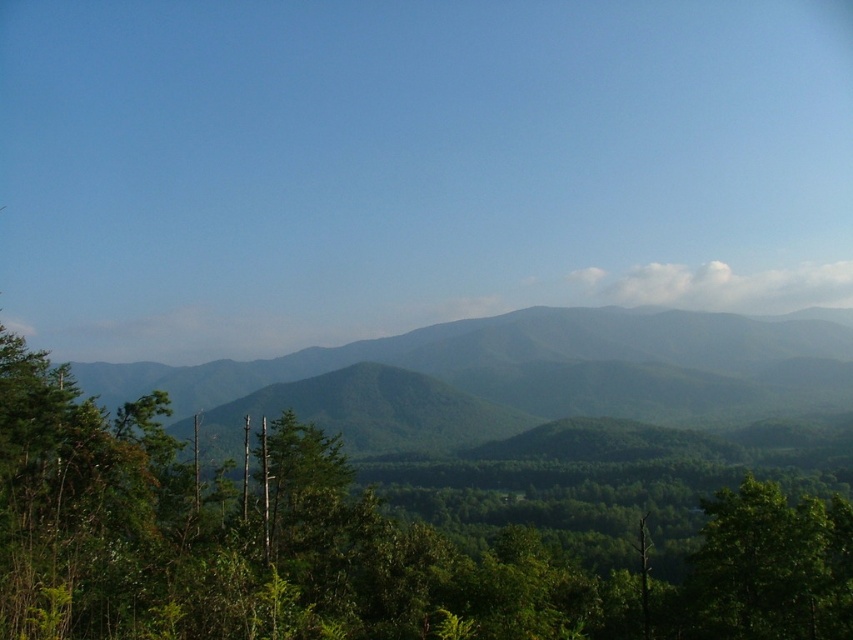
You are a hiker standing at the base of the green leafy tree at lower right. You want to reach the green matte mountain range at center. Which direction should you move to get closer to the mountain range?

You should move away from the green leafy tree at lower right towards the green matte mountain range at center because the mountain range is further away from you than the tree.